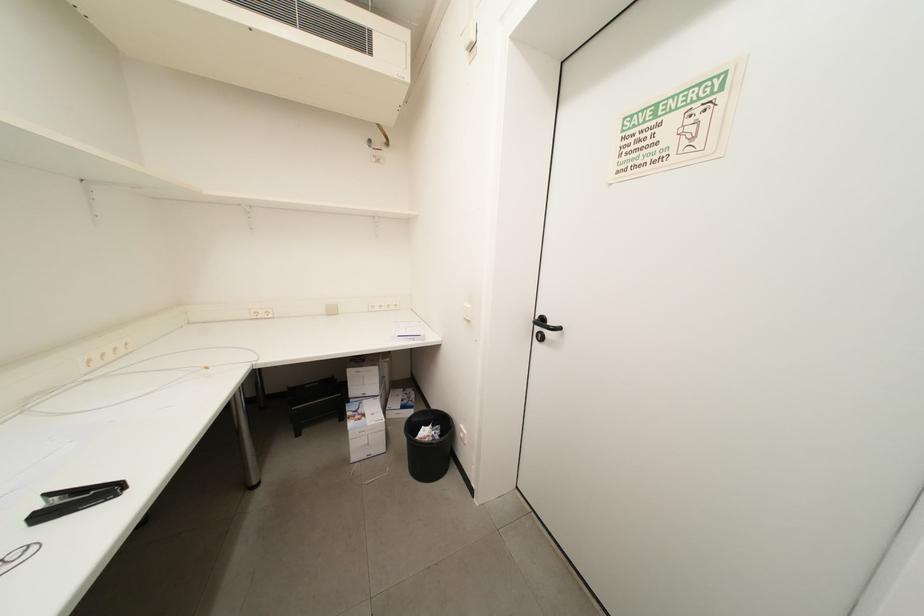
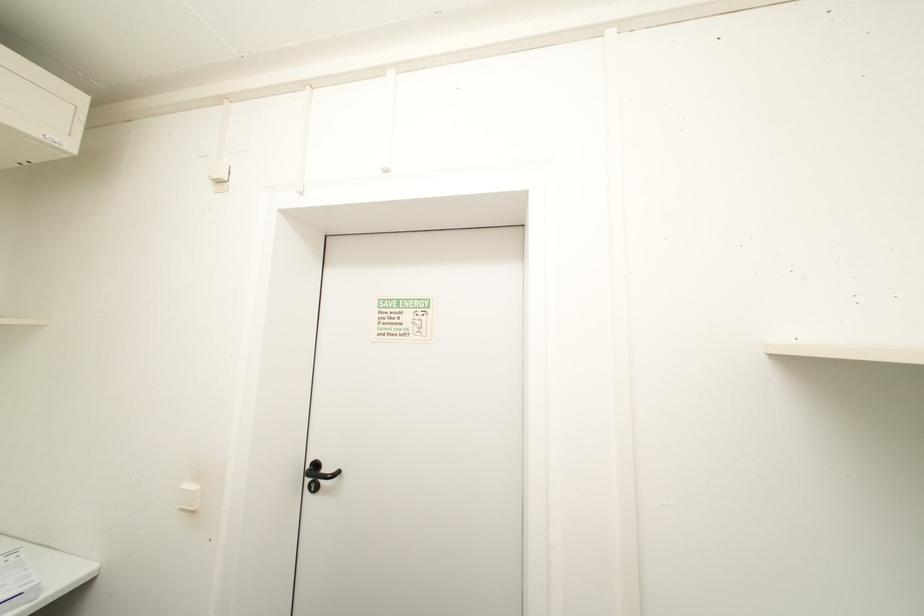
Question: Based on the continuous images, in which direction is the camera rotating? Reply with the corresponding letter.

Choices:
 (A) Left
 (B) Right
 (C) Up
 (D) Down

Answer: (B)